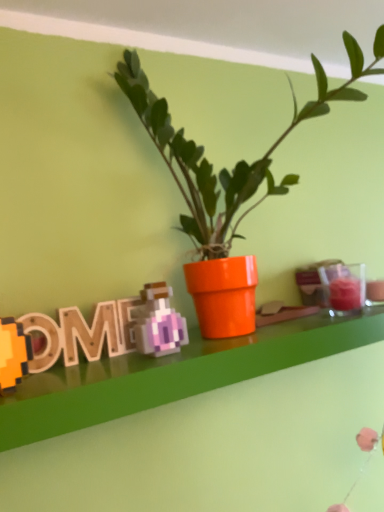
Question: Is wooden pixelated letter at left thinner than orange glossy pot at center?

Choices:
 (A) yes
 (B) no

Answer: (A)

Question: Is wooden pixelated letter at left to the left of orange glossy pot at center from the viewer's perspective?

Choices:
 (A) yes
 (B) no

Answer: (A)

Question: From the image's perspective, is wooden pixelated letter at left on orange glossy pot at center?

Choices:
 (A) no
 (B) yes

Answer: (A)

Question: From a real-world perspective, is wooden pixelated letter at left located beneath orange glossy pot at center?

Choices:
 (A) yes
 (B) no

Answer: (A)

Question: Are wooden pixelated letter at left and orange glossy pot at center far apart?

Choices:
 (A) no
 (B) yes

Answer: (A)

Question: From the image's perspective, is wooden pixelated letter at left below orange glossy pot at center?

Choices:
 (A) no
 (B) yes

Answer: (B)

Question: From a real-world perspective, is orange glossy pot at center beneath wooden pixelated letter at left?

Choices:
 (A) no
 (B) yes

Answer: (A)

Question: Is the depth of orange glossy pot at center greater than that of wooden pixelated letter at left?

Choices:
 (A) yes
 (B) no

Answer: (B)

Question: Could you tell me if orange glossy pot at center is facing wooden pixelated letter at left?

Choices:
 (A) yes
 (B) no

Answer: (B)

Question: From the image's perspective, is orange glossy pot at center on wooden pixelated letter at left?

Choices:
 (A) no
 (B) yes

Answer: (B)

Question: Can you confirm if orange glossy pot at center is positioned to the right of wooden pixelated letter at left?

Choices:
 (A) no
 (B) yes

Answer: (B)

Question: Can you confirm if orange glossy pot at center is shorter than wooden pixelated letter at left?

Choices:
 (A) no
 (B) yes

Answer: (A)

Question: From the image's perspective, relative to wooden pixelated letter at left, is orange glossy pot at center above or below?

Choices:
 (A) above
 (B) below

Answer: (A)